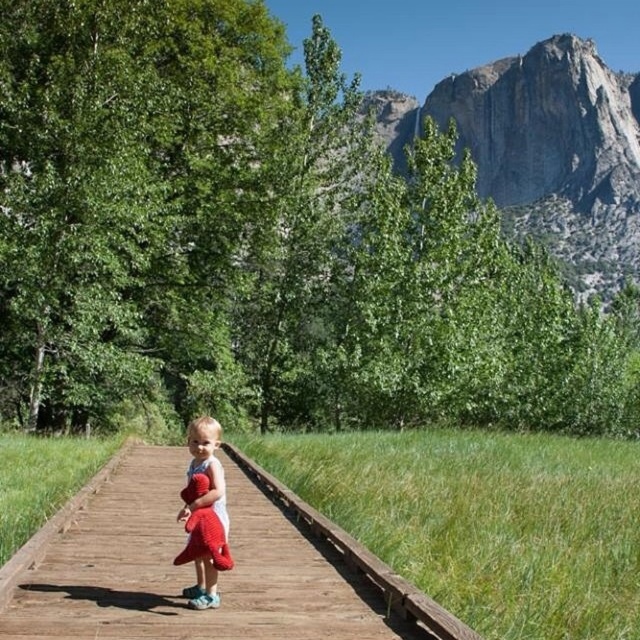
At what (x,y) coordinates should I click in order to perform the action: click on wooden boardwalk at center. Please return your answer as a coordinate pair (x, y). This screenshot has height=640, width=640. Looking at the image, I should click on (186, 570).

Can you confirm if wooden boardwalk at center is bigger than soft plush toy at center?

Yes, wooden boardwalk at center is bigger than soft plush toy at center.

Find the location of a particular element. The height and width of the screenshot is (640, 640). wooden boardwalk at center is located at coordinates (186, 570).

Identify the location of wooden boardwalk at center. The image size is (640, 640). (186, 570).